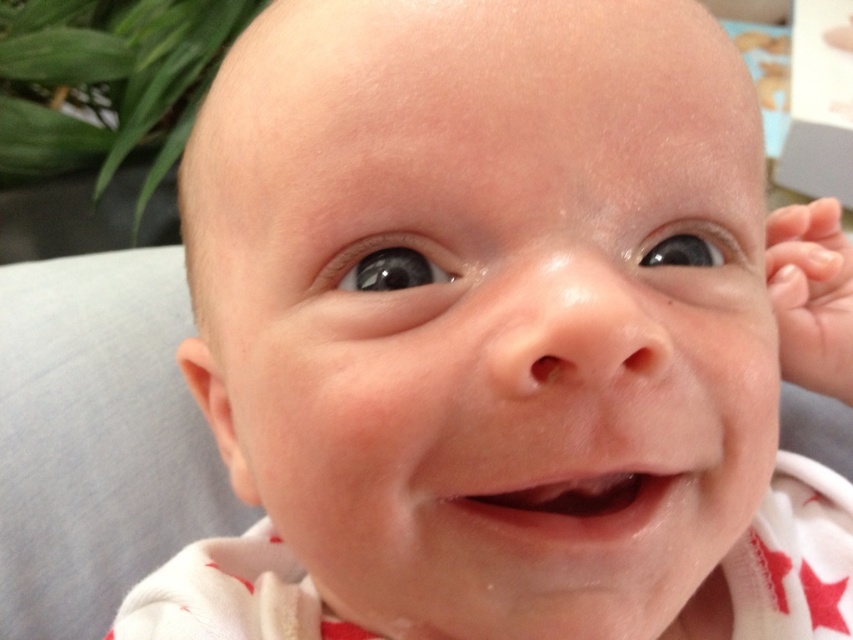
Question: Estimate the real-world distances between objects in this image. Which object is farther from the pale skin hand at right?

Choices:
 (A) smooth flesh mouth at center
 (B) smooth skin baby at center

Answer: (A)

Question: Which point is farther to the camera?

Choices:
 (A) (546, 496)
 (B) (827, 256)

Answer: (B)

Question: Which object is closer to the camera taking this photo?

Choices:
 (A) smooth flesh mouth at center
 (B) smooth skin baby at center
 (C) pale skin hand at right

Answer: (B)

Question: Can you confirm if smooth skin baby at center is positioned above pale skin hand at right?

Choices:
 (A) no
 (B) yes

Answer: (A)

Question: Is smooth skin baby at center to the left of smooth flesh mouth at center from the viewer's perspective?

Choices:
 (A) yes
 (B) no

Answer: (A)

Question: Can you confirm if smooth skin baby at center is wider than pale skin hand at right?

Choices:
 (A) yes
 (B) no

Answer: (A)